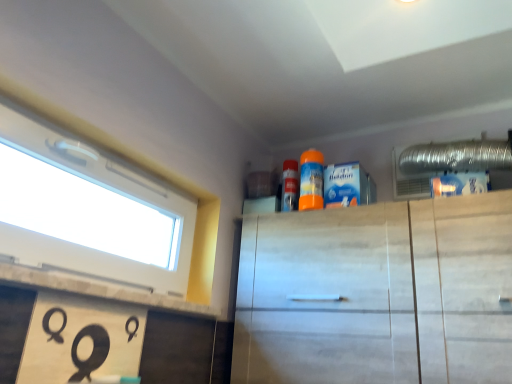
Question: Is orange matte spray can at upper center inside the boundaries of white marble cabinet at upper center, or outside?

Choices:
 (A) inside
 (B) outside

Answer: (B)

Question: Considering the positions of orange matte spray can at upper center and white marble cabinet at upper center in the image, is orange matte spray can at upper center wider or thinner than white marble cabinet at upper center?

Choices:
 (A) thin
 (B) wide

Answer: (A)

Question: Which object is the farthest from the orange matte spray can at upper center?

Choices:
 (A) white plastic window at upper left
 (B) white marble cabinet at upper center

Answer: (A)

Question: Estimate the real-world distances between objects in this image. Which object is farther from the orange matte spray can at upper center?

Choices:
 (A) white marble cabinet at upper center
 (B) white plastic window at upper left

Answer: (B)